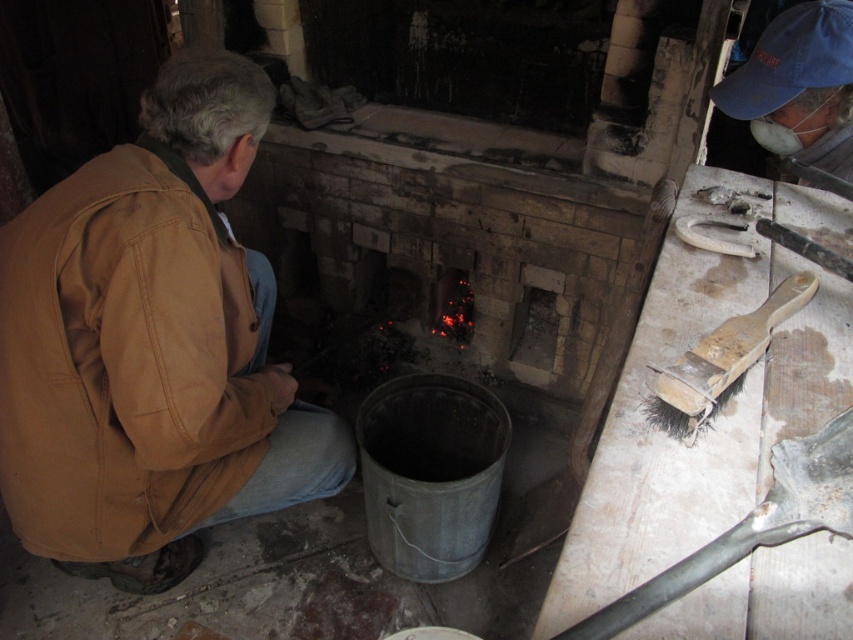
Can you confirm if brown cotton jacket at lower left is bigger than blue fabric cap at upper right?

Yes, brown cotton jacket at lower left is bigger than blue fabric cap at upper right.

Can you confirm if brown cotton jacket at lower left is positioned to the right of blue fabric cap at upper right?

No, brown cotton jacket at lower left is not to the right of blue fabric cap at upper right.

Is point (0, 250) more distant than point (820, 51)?

No, it is not.

The image size is (853, 640). I want to click on brown cotton jacket at lower left, so click(x=151, y=346).

Consider the image. Is blue fabric cap at upper right to the left of wooden-bristled brush at right from the viewer's perspective?

No, blue fabric cap at upper right is not to the left of wooden-bristled brush at right.

Does point (842, 20) come behind point (788, 300)?

That is True.

Where is `blue fabric cap at upper right`? blue fabric cap at upper right is located at coordinates (798, 86).

Can you confirm if brown cotton jacket at lower left is bigger than wooden-bristled brush at right?

Yes.

Who is more distant from viewer, [216,144] or [694,422]?

The point [216,144] is behind.

Where is `brown cotton jacket at lower left`? The width and height of the screenshot is (853, 640). brown cotton jacket at lower left is located at coordinates (151, 346).